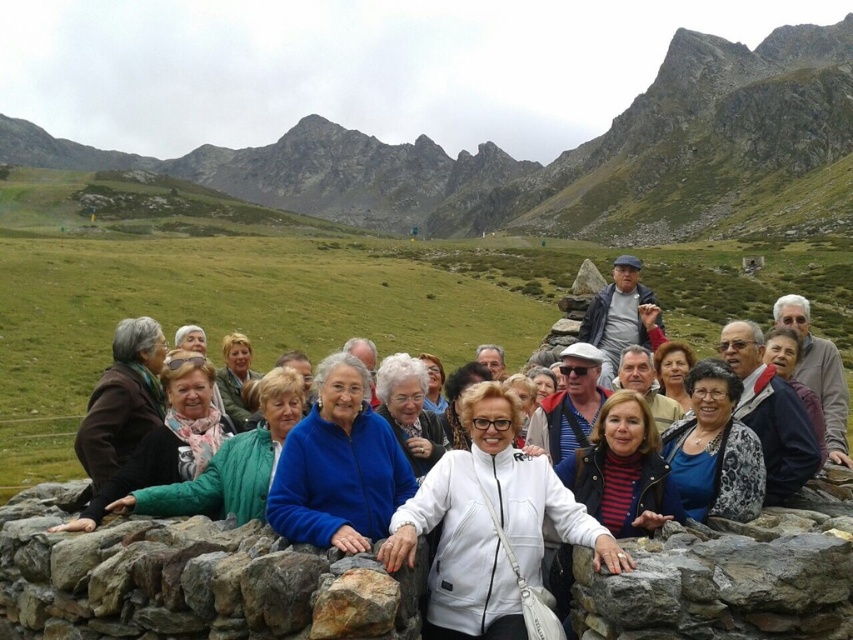
You are standing in front of the group of people posing behind the stone wall. You want to take a photo that includes both the point at coordinate (405, 637) and the point at coordinate (795, 538). Which point should you focus on first to ensure both are in sharp focus?

You should focus on point (405, 637) first because it is closer to the camera than point (795, 538). This ensures that both points will be within the depth of field and in sharp focus.